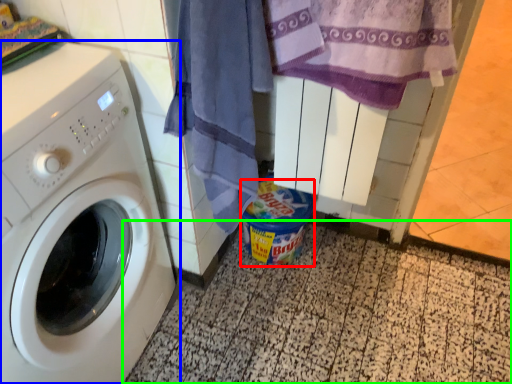
Question: Considering the real-world distances, which object is closest to garbage (highlighted by a red box)? washing machine (highlighted by a blue box) or tile (highlighted by a green box).

Choices:
 (A) washing machine
 (B) tile

Answer: (B)